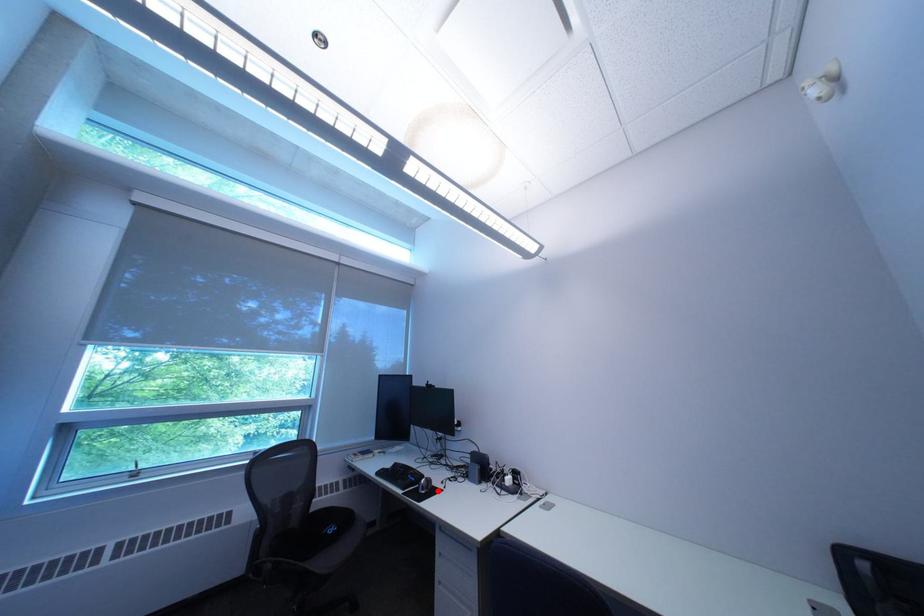
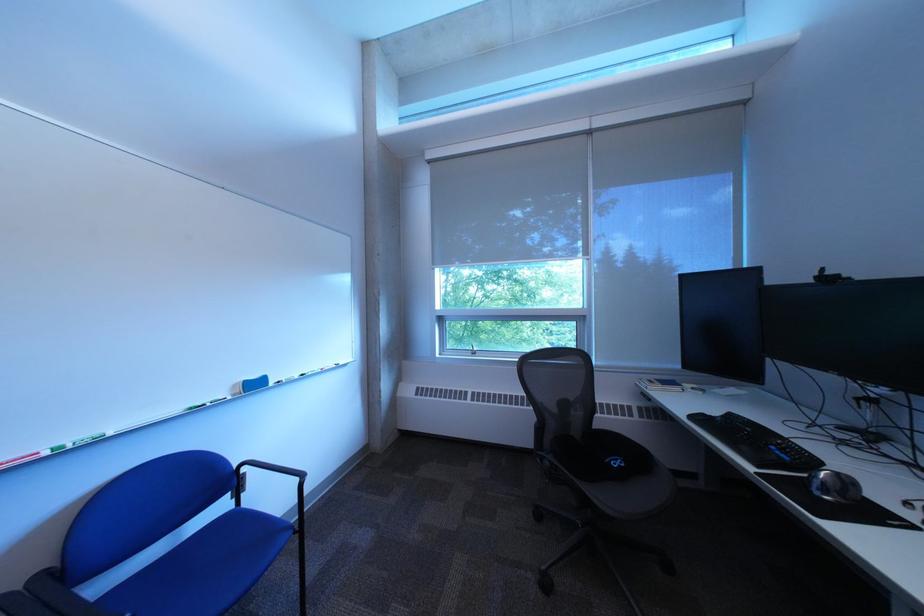
The point at the highlighted location is marked in the first image. Where is the corresponding point in the second image?

(841, 493)